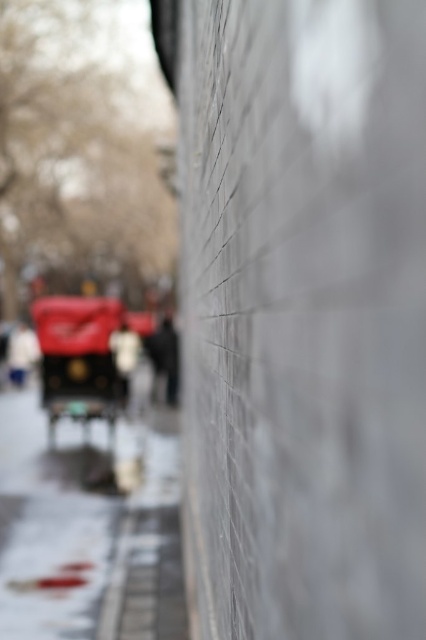
Question: Does white matte jacket at left appear on the right side of white cotton jacket at center?

Choices:
 (A) no
 (B) yes

Answer: (A)

Question: Is concrete pavement at lower left above shiny red car at left?

Choices:
 (A) yes
 (B) no

Answer: (B)

Question: Which is farther from the shiny red car at left?

Choices:
 (A) white matte jacket at left
 (B) concrete pavement at lower left
 (C) dark gray fabric jacket at center
 (D) white cotton jacket at center

Answer: (A)

Question: Is shiny red car at left closer to camera compared to dark gray fabric jacket at center?

Choices:
 (A) yes
 (B) no

Answer: (A)

Question: Which object appears farthest from the camera in this image?

Choices:
 (A) dark gray fabric jacket at center
 (B) shiny red car at left
 (C) concrete pavement at lower left

Answer: (A)

Question: Which is nearer to the shiny red car at left?

Choices:
 (A) white cotton jacket at center
 (B) dark gray fabric jacket at center

Answer: (A)